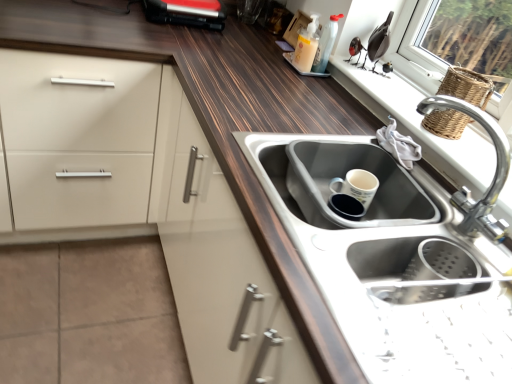
Question: Is translucent plastic bottle at upper right, the 1th bottle from the right, at the right side of wooden window sill at upper right?

Choices:
 (A) no
 (B) yes

Answer: (A)

Question: Is translucent plastic bottle at upper right, the 1th bottle from the right, outside wooden window sill at upper right?

Choices:
 (A) no
 (B) yes

Answer: (B)

Question: From the image's perspective, is translucent plastic bottle at upper right, the 1th bottle from the right, above wooden window sill at upper right?

Choices:
 (A) yes
 (B) no

Answer: (A)

Question: Is translucent plastic bottle at upper right, the second bottle positioned from the left, closer to the viewer compared to wooden window sill at upper right?

Choices:
 (A) yes
 (B) no

Answer: (B)

Question: Is translucent plastic bottle at upper right, the 1th bottle from the right, taller than wooden window sill at upper right?

Choices:
 (A) yes
 (B) no

Answer: (A)

Question: Would you say translucent plastic bottle at upper right, the 1th bottle from the right, contains wooden window sill at upper right?

Choices:
 (A) no
 (B) yes

Answer: (A)

Question: Considering the relative positions of wooden window sill at upper right and woven brown basket at upper right in the image provided, is wooden window sill at upper right in front of woven brown basket at upper right?

Choices:
 (A) yes
 (B) no

Answer: (A)

Question: Is wooden window sill at upper right wider than woven brown basket at upper right?

Choices:
 (A) yes
 (B) no

Answer: (A)

Question: Considering the relative sizes of wooden window sill at upper right and woven brown basket at upper right in the image provided, is wooden window sill at upper right thinner than woven brown basket at upper right?

Choices:
 (A) yes
 (B) no

Answer: (B)

Question: Does wooden window sill at upper right have a lesser height compared to woven brown basket at upper right?

Choices:
 (A) no
 (B) yes

Answer: (B)

Question: Is wooden window sill at upper right taller than woven brown basket at upper right?

Choices:
 (A) no
 (B) yes

Answer: (A)

Question: From the image's perspective, is wooden window sill at upper right on top of woven brown basket at upper right?

Choices:
 (A) no
 (B) yes

Answer: (A)

Question: From the image's perspective, does wooden window sill at upper right appear higher than translucent plastic soap dispenser at upper center, which is counted as the 1th bottle, starting from the left?

Choices:
 (A) yes
 (B) no

Answer: (B)